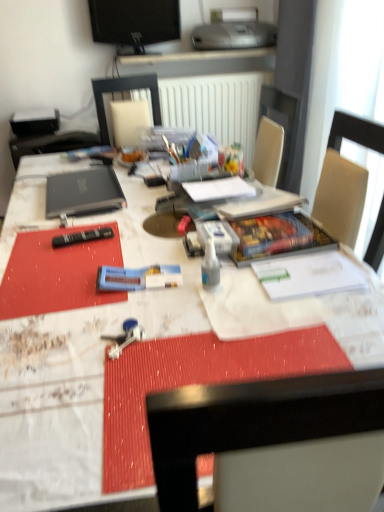
At what (x,y) coordinates should I click in order to perform the action: click on vacant area that lies in front of transparent plastic bottle at center. Please return your answer as a coordinate pair (x, y). Looking at the image, I should click on (218, 327).